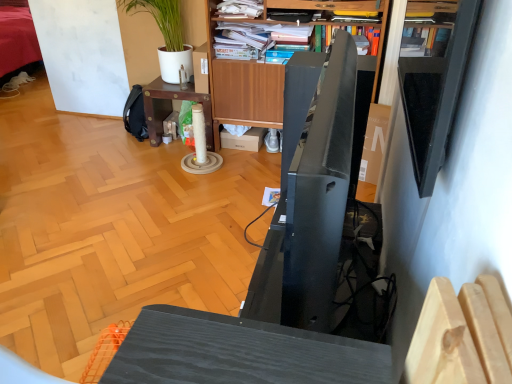
Question: From their relative heights in the image, would you say hardcover book at upper center is taller or shorter than wooden bookshelf at upper center?

Choices:
 (A) short
 (B) tall

Answer: (B)

Question: From a real-world perspective, is hardcover book at upper center above or below wooden bookshelf at upper center?

Choices:
 (A) above
 (B) below

Answer: (B)

Question: Based on their relative distances, which object is nearer to the wooden desk at center?

Choices:
 (A) green matte plant at upper left
 (B) hardcover book at upper center
 (C) wooden bookcase at upper center
 (D) wooden bookshelf at upper center

Answer: (C)

Question: Considering the real-world distances, which object is closest to the wooden desk at center?

Choices:
 (A) green matte plant at upper left
 (B) hardcover book at upper center
 (C) wooden bookcase at upper center
 (D) wooden bookshelf at upper center

Answer: (C)